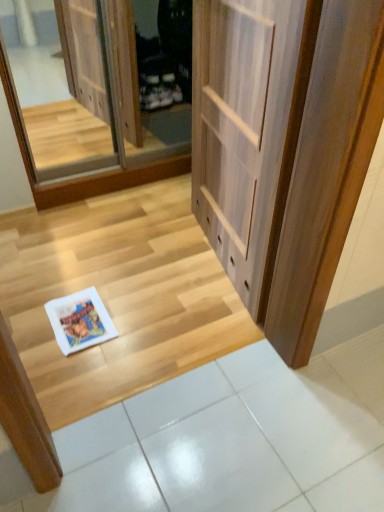
Question: Should I look upward or downward to see wooden floor at lower left?

Choices:
 (A) down
 (B) up

Answer: (A)

Question: Is white glossy tile at lower center positioned far away from wooden floor at lower left?

Choices:
 (A) no
 (B) yes

Answer: (A)

Question: Is white glossy tile at lower center placed right next to wooden floor at lower left?

Choices:
 (A) yes
 (B) no

Answer: (B)

Question: From a real-world perspective, is white glossy tile at lower center on wooden floor at lower left?

Choices:
 (A) no
 (B) yes

Answer: (A)

Question: Considering the relative positions of white glossy tile at lower center and wooden floor at lower left in the image provided, is white glossy tile at lower center in front of wooden floor at lower left?

Choices:
 (A) yes
 (B) no

Answer: (A)

Question: Does white glossy tile at lower center appear on the right side of wooden floor at lower left?

Choices:
 (A) yes
 (B) no

Answer: (A)

Question: Considering the relative sizes of white glossy tile at lower center and wooden floor at lower left in the image provided, is white glossy tile at lower center thinner than wooden floor at lower left?

Choices:
 (A) no
 (B) yes

Answer: (B)

Question: Is light wood door at center positioned beyond the bounds of white glossy tile at lower center?

Choices:
 (A) yes
 (B) no

Answer: (A)

Question: Considering the relative sizes of light wood door at center and white glossy tile at lower center in the image provided, is light wood door at center wider than white glossy tile at lower center?

Choices:
 (A) yes
 (B) no

Answer: (B)

Question: Can you confirm if light wood door at center is bigger than white glossy tile at lower center?

Choices:
 (A) no
 (B) yes

Answer: (B)

Question: Is white glossy tile at lower center surrounded by light wood door at center?

Choices:
 (A) no
 (B) yes

Answer: (A)

Question: Are light wood door at center and white glossy tile at lower center far apart?

Choices:
 (A) no
 (B) yes

Answer: (A)

Question: From a real-world perspective, is light wood door at center on top of white glossy tile at lower center?

Choices:
 (A) yes
 (B) no

Answer: (A)

Question: Considering the relative sizes of clear glass screen door at upper left and white glossy tile at lower center in the image provided, is clear glass screen door at upper left smaller than white glossy tile at lower center?

Choices:
 (A) yes
 (B) no

Answer: (B)